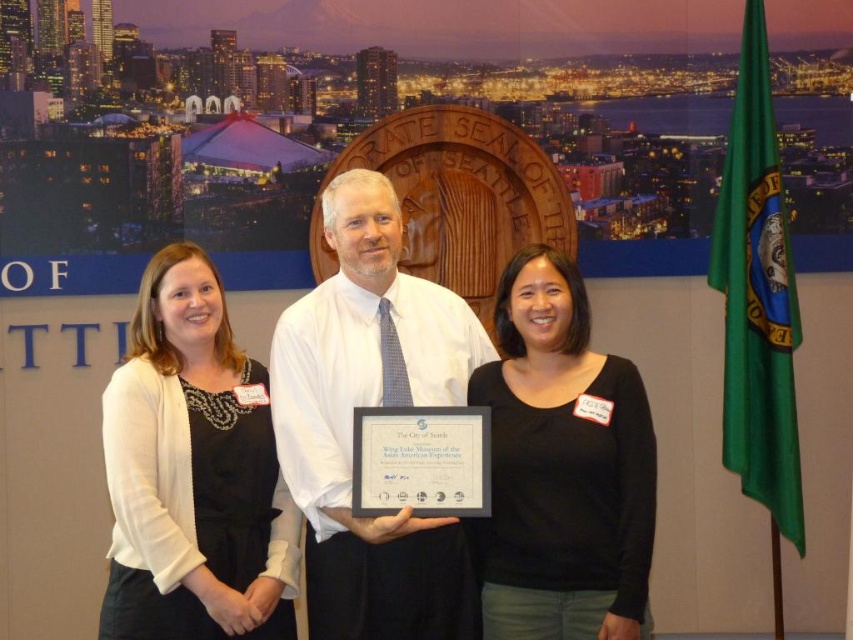
You are a photographer at the event and need to adjust the lighting so that both the white shirt at center and the black matte shirt at center are equally visible. Considering their heights, which shirt should you focus on first?

The white shirt at center has a greater height compared to the black matte shirt at center, so you should focus on adjusting the lighting for the white shirt at center first to ensure it doesn

You are a photographer adjusting the camera focus. The camera can only focus on objects within a 12 inch range. You see the black matte shirt at center and the white paper at center. Can both objects be in focus at the same time?

The distance between the black matte shirt at center and the white paper at center is 15.60 inches. Since the camera can only focus within a 12 inch range, both objects cannot be in focus simultaneously.